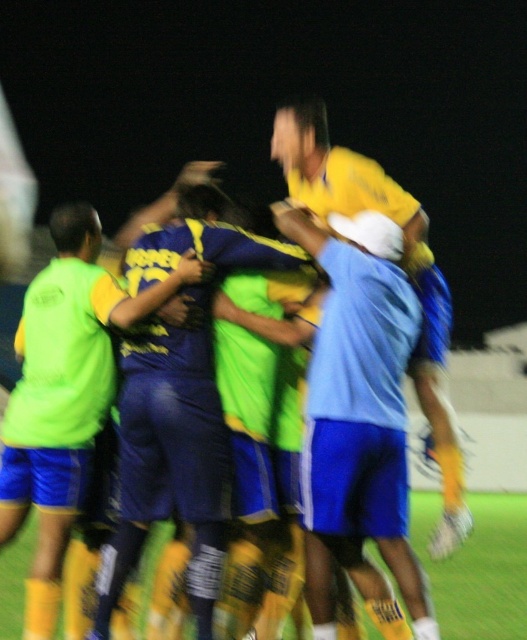
Describe the element at coordinates (170, 456) in the screenshot. I see `blue jersey at center` at that location.

Is point (128, 452) positioned behind point (418, 547)?

No, (128, 452) is in front of (418, 547).

Where is `blue jersey at center`? The image size is (527, 640). blue jersey at center is located at coordinates (170, 456).

Is neon green jersey at left positioned at the back of yellow matte jersey at center?

No, neon green jersey at left is closer to the viewer.

Does point (63, 422) come behind point (352, 189)?

No, it is not.

The height and width of the screenshot is (640, 527). Describe the element at coordinates (64, 394) in the screenshot. I see `neon green jersey at left` at that location.

Locate an element on the screen. Image resolution: width=527 pixels, height=640 pixels. neon green jersey at left is located at coordinates (64, 394).

Is yellow matte jersey at center closer to the viewer compared to green grass at center?

Yes, yellow matte jersey at center is in front of green grass at center.

Which of these two, yellow matte jersey at center or green grass at center, stands shorter?

Standing shorter between the two is green grass at center.

Who is more forward, (424,230) or (14,602)?

Point (424,230) is in front.

Locate an element on the screen. yellow matte jersey at center is located at coordinates (403, 268).